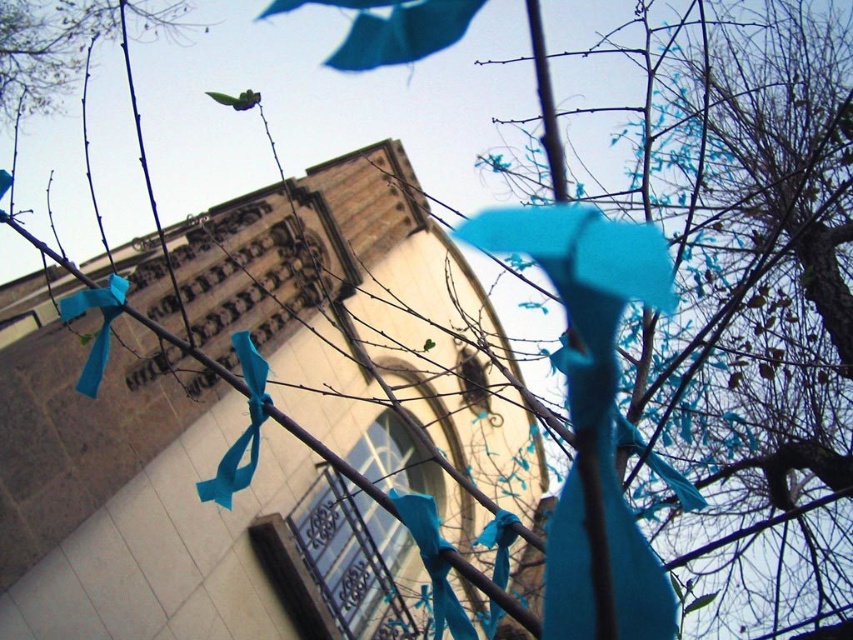
Does teal fabric ribbon at center have a lesser width compared to matte blue ribbon at left?

Yes.

Does teal fabric ribbon at center lie in front of matte blue ribbon at left?

Yes, it is in front of matte blue ribbon at left.

Does point (434, 637) come closer to viewer compared to point (64, 314)?

That is False.

Find the location of a particular element. The height and width of the screenshot is (640, 853). teal fabric ribbon at center is located at coordinates (433, 561).

Is matte blue ribbon at center to the right of matte blue ribbon at left from the viewer's perspective?

Correct, you'll find matte blue ribbon at center to the right of matte blue ribbon at left.

This screenshot has width=853, height=640. Identify the location of matte blue ribbon at center. (242, 429).

This screenshot has width=853, height=640. I want to click on matte blue ribbon at center, so click(x=242, y=429).

Which is in front, point (473, 636) or point (245, 449)?

Point (473, 636)

Does point (425, 508) come behind point (260, 396)?

No.

Does point (421, 550) lie behind point (260, 380)?

No, (421, 550) is in front of (260, 380).

This screenshot has height=640, width=853. What are the coordinates of `teal fabric ribbon at center` in the screenshot? It's located at (433, 561).